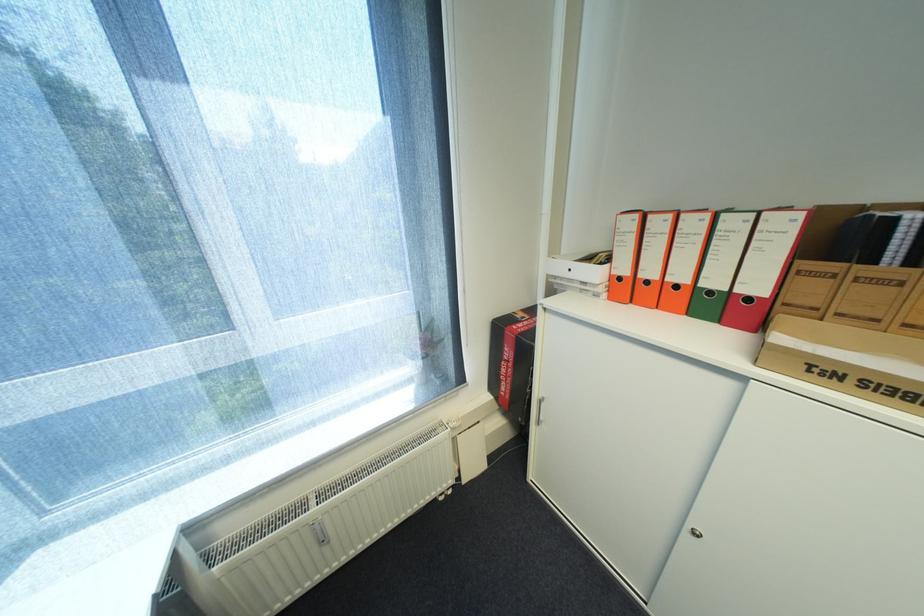
Where is `green ring binder`? The image size is (924, 616). green ring binder is located at coordinates (720, 264).